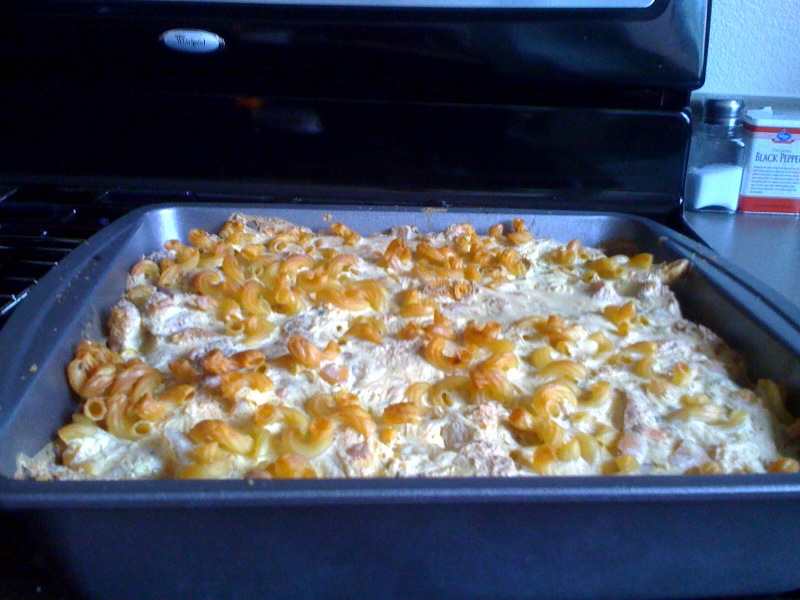
Locate an element on the screen. This screenshot has height=600, width=800. counter top is located at coordinates (750, 232), (777, 256).